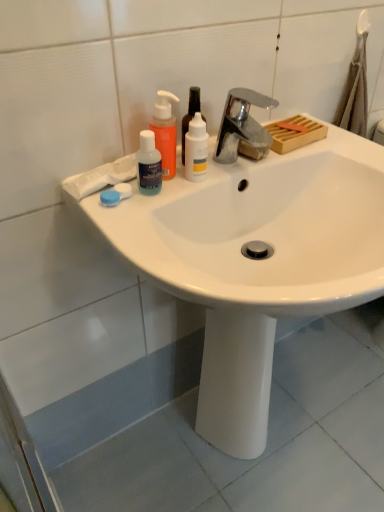
At what (x,y) coordinates should I click in order to perform the action: click on spots to the right of blue plastic contact lens case at left. Please return your answer as a coordinate pair (x, y). This screenshot has width=384, height=512. Looking at the image, I should click on (183, 189).